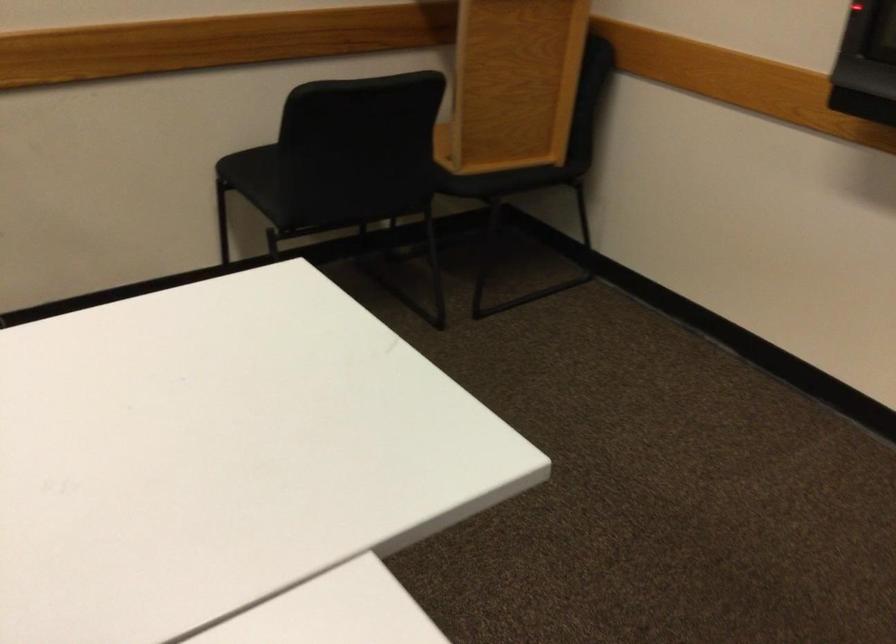
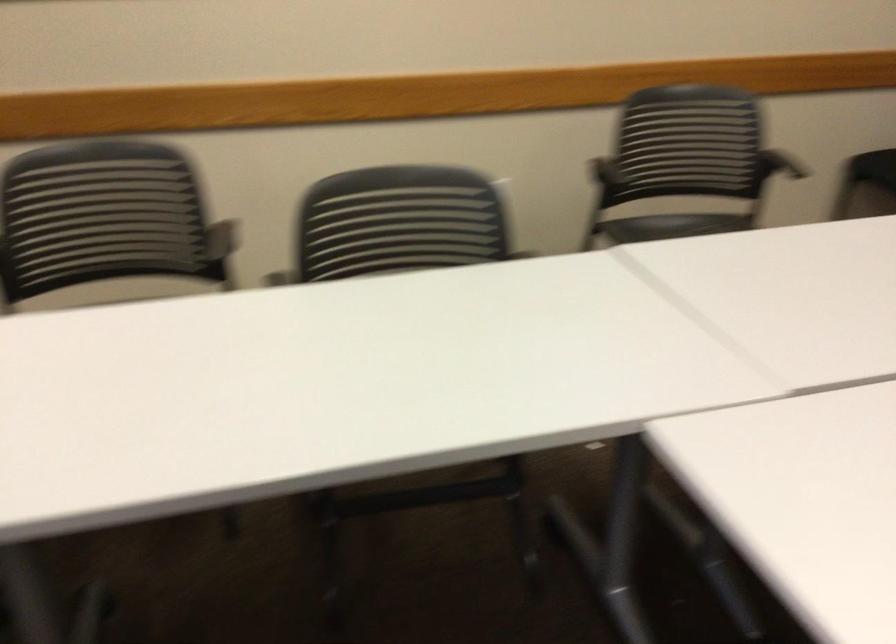
The point at (110, 191) is marked in the first image. Where is the corresponding point in the second image?

(790, 166)